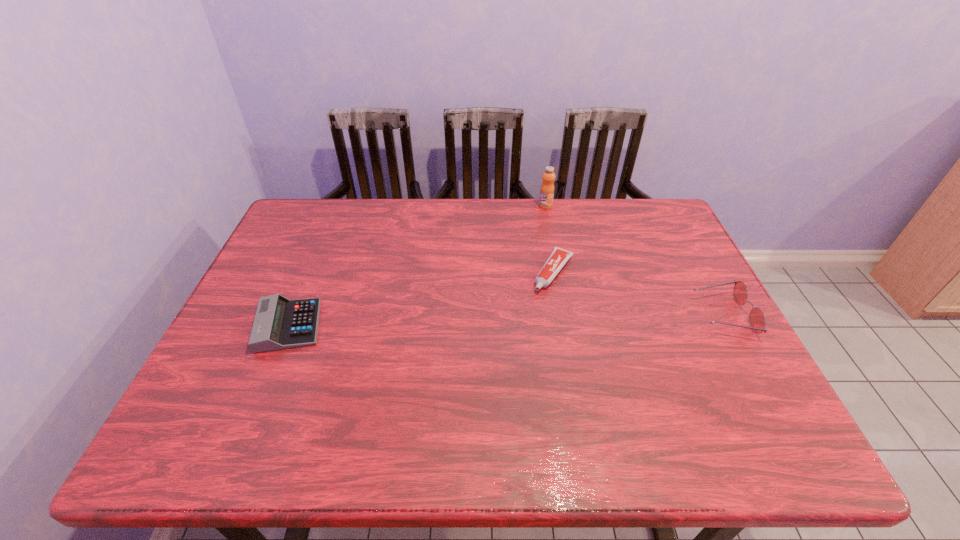
Where is `vacant space on the desktop that is between the calculator and the rightmost object and is positioned at the nozzle of the toothpaste`? The height and width of the screenshot is (540, 960). vacant space on the desktop that is between the calculator and the rightmost object and is positioned at the nozzle of the toothpaste is located at coordinates (521, 320).

This screenshot has width=960, height=540. Identify the location of vacant spot on the desktop that is between the leftmost object and the rightmost object and is positioned on the front label of the orange juice. (495, 320).